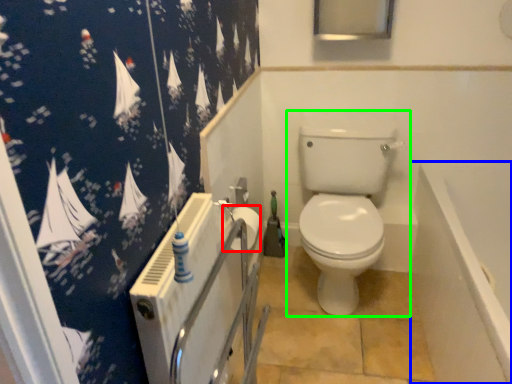
Question: Which is farther away from toilet paper (highlighted by a red box)? bath (highlighted by a blue box) or toilet (highlighted by a green box)?

Choices:
 (A) bath
 (B) toilet

Answer: (A)